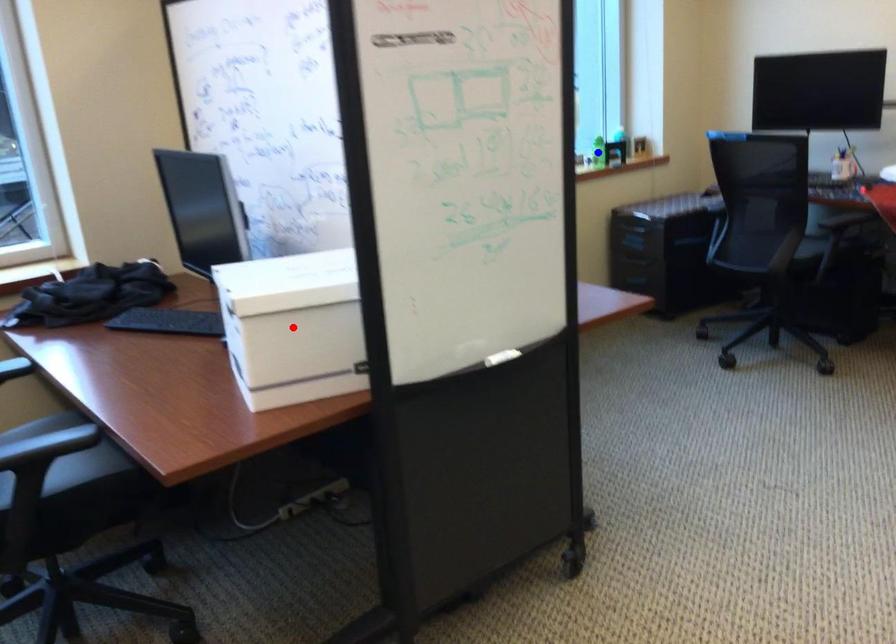
Question: Two points are marked on the image. Which point is closer to the camera?

Choices:
 (A) Blue point is closer.
 (B) Red point is closer.

Answer: (B)